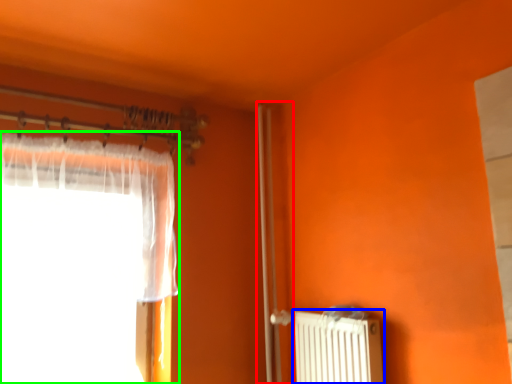
Question: Based on their relative distances, which object is farther from screen door (highlighted by a red box)? Choose from radiator (highlighted by a blue box) and curtain (highlighted by a green box).

Choices:
 (A) radiator
 (B) curtain

Answer: (B)